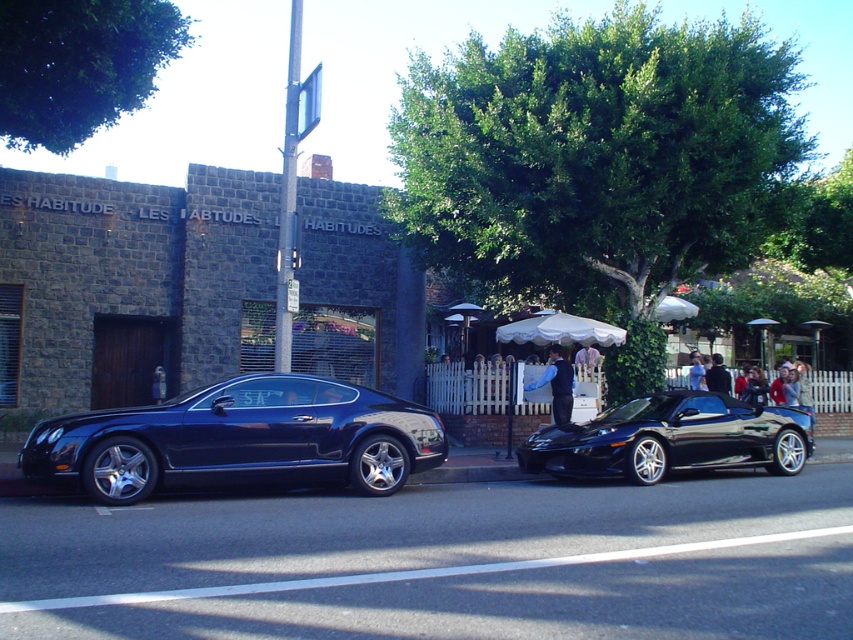
Is dark blue leather jacket at center taller than light brown leather jacket at center?

Correct, dark blue leather jacket at center is much taller as light brown leather jacket at center.

Identify the location of dark blue leather jacket at center. (717, 376).

Is blue velvet vest at center below light brown leather jacket at center?

Yes.

Is point (563, 372) farther from viewer compared to point (691, 387)?

That is False.

Identify the location of blue velvet vest at center. The image size is (853, 640). (556, 385).

Between shiny dark blue car at left and dark blue leather jacket at center, which one appears on the right side from the viewer's perspective?

dark blue leather jacket at center

Is shiny dark blue car at left to the left of dark blue leather jacket at center from the viewer's perspective?

Indeed, shiny dark blue car at left is positioned on the left side of dark blue leather jacket at center.

This screenshot has width=853, height=640. What do you see at coordinates (239, 438) in the screenshot?
I see `shiny dark blue car at left` at bounding box center [239, 438].

At what (x,y) coordinates should I click in order to perform the action: click on shiny dark blue car at left. Please return your answer as a coordinate pair (x, y). This screenshot has width=853, height=640. Looking at the image, I should click on (239, 438).